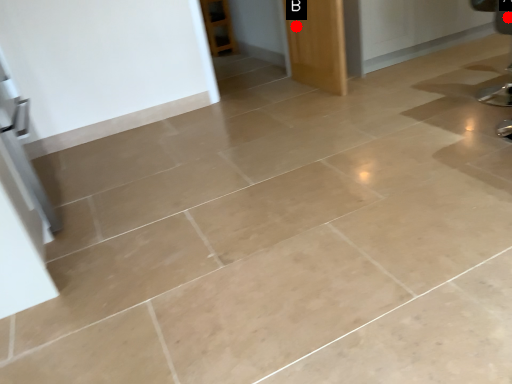
Question: Two points are circled on the image, labeled by A and B beside each circle. Among these points, which one is farthest from the camera?

Choices:
 (A) A is further
 (B) B is further

Answer: (A)